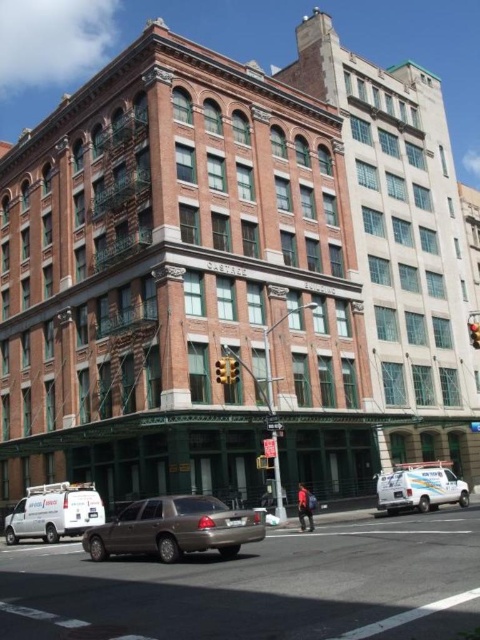
Which of these two, gold metallic sedan at lower center or metallic rectangular traffic light at center, stands taller?

gold metallic sedan at lower center

Which is in front, point (478, 620) or point (232, 381)?

Point (478, 620) is in front.

Image resolution: width=480 pixels, height=640 pixels. In order to click on gold metallic sedan at lower center in this screenshot , I will do `click(260, 586)`.

At what (x,y) coordinates should I click in order to perform the action: click on gold metallic sedan at lower center. Please return your answer as a coordinate pair (x, y). This screenshot has height=640, width=480. Looking at the image, I should click on (260, 586).

Which is more to the right, red glass traffic light at upper right or metallic rectangular traffic light at center?

red glass traffic light at upper right is more to the right.

Does red glass traffic light at upper right appear on the left side of metallic rectangular traffic light at center?

Incorrect, red glass traffic light at upper right is not on the left side of metallic rectangular traffic light at center.

Between point (479, 321) and point (236, 362), which one is positioned behind?

The point (479, 321) is more distant.

You are a GUI agent. You are given a task and a screenshot of the screen. Output one action in this format:
    pyautogui.click(x=<x>, y=<y>)
    Task: Click on the red glass traffic light at upper right
    This screenshot has height=640, width=480.
    Given the screenshot: What is the action you would take?
    pyautogui.click(x=474, y=333)

Is white matte van at lower right positioned before metallic rectangular traffic light at center?

No, it is not.

How far apart are white matte van at lower right and metallic rectangular traffic light at center?

white matte van at lower right is 17.30 meters away from metallic rectangular traffic light at center.

Is point (431, 484) more distant than point (236, 372)?

Yes, point (431, 484) is farther from viewer.

Locate an element on the screen. This screenshot has height=640, width=480. white matte van at lower right is located at coordinates (420, 486).